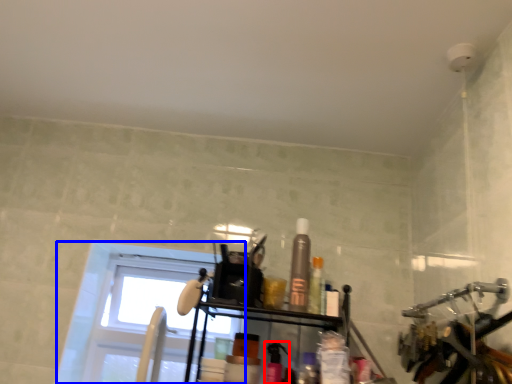
Question: Which object appears closest to the camera in this image, toiletry (highlighted by a red box) or window (highlighted by a blue box)?

Choices:
 (A) toiletry
 (B) window

Answer: (A)